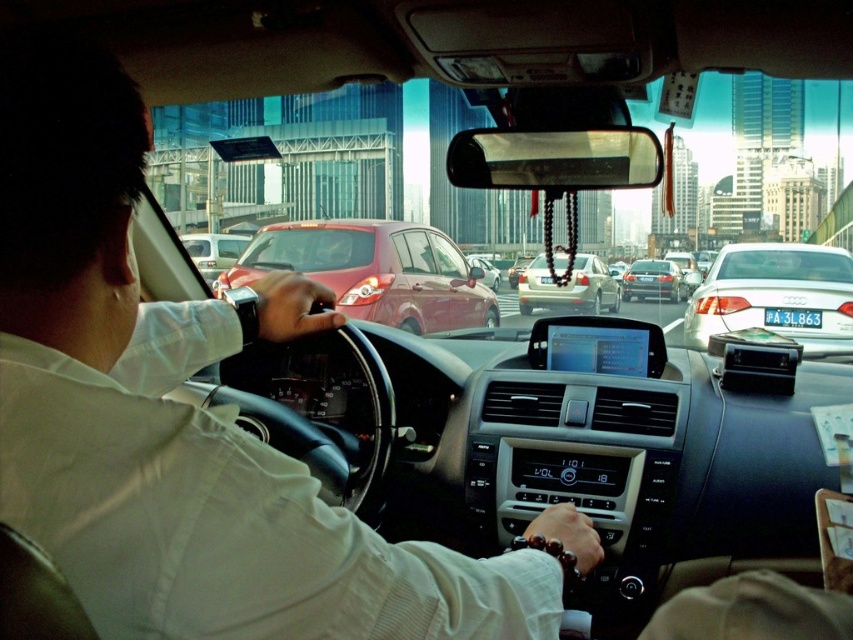
Can you confirm if white shirt at center is positioned below glossy red car at center?

Correct, white shirt at center is located below glossy red car at center.

Does white shirt at center have a smaller size compared to glossy red car at center?

Indeed, white shirt at center has a smaller size compared to glossy red car at center.

Where is `white shirt at center`? white shirt at center is located at coordinates (175, 419).

Does satin black sedan at center appear on the right side of matte red sedan at center?

Correct, you'll find satin black sedan at center to the right of matte red sedan at center.

Is satin black sedan at center bigger than matte red sedan at center?

Yes, satin black sedan at center is bigger than matte red sedan at center.

The width and height of the screenshot is (853, 640). I want to click on satin black sedan at center, so click(x=653, y=280).

I want to click on satin black sedan at center, so click(653, 280).

This screenshot has height=640, width=853. What do you see at coordinates (776, 296) in the screenshot? I see `silver metallic sedan at right` at bounding box center [776, 296].

Is the position of silver metallic sedan at right more distant than that of matte white van at center?

That is False.

Which is behind, point (798, 282) or point (213, 275)?

The point (213, 275) is behind.

What are the coordinates of `silver metallic sedan at right` in the screenshot? It's located at (776, 296).